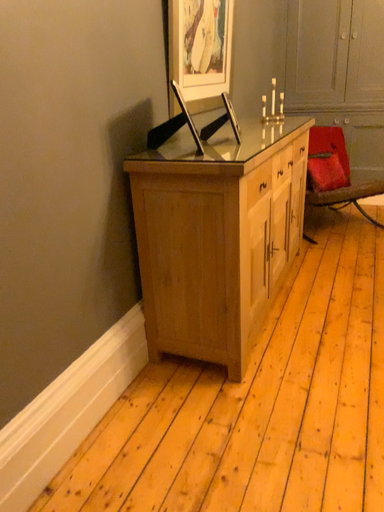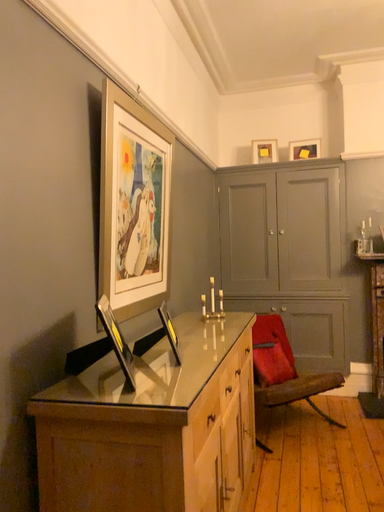
Question: How did the camera likely rotate when shooting the video?

Choices:
 (A) rotated left
 (B) rotated right

Answer: (B)